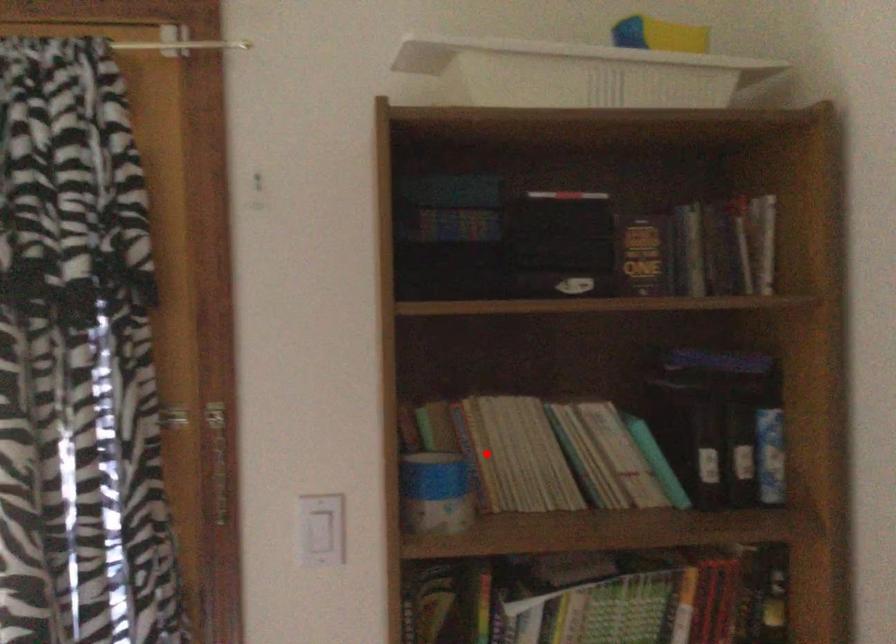
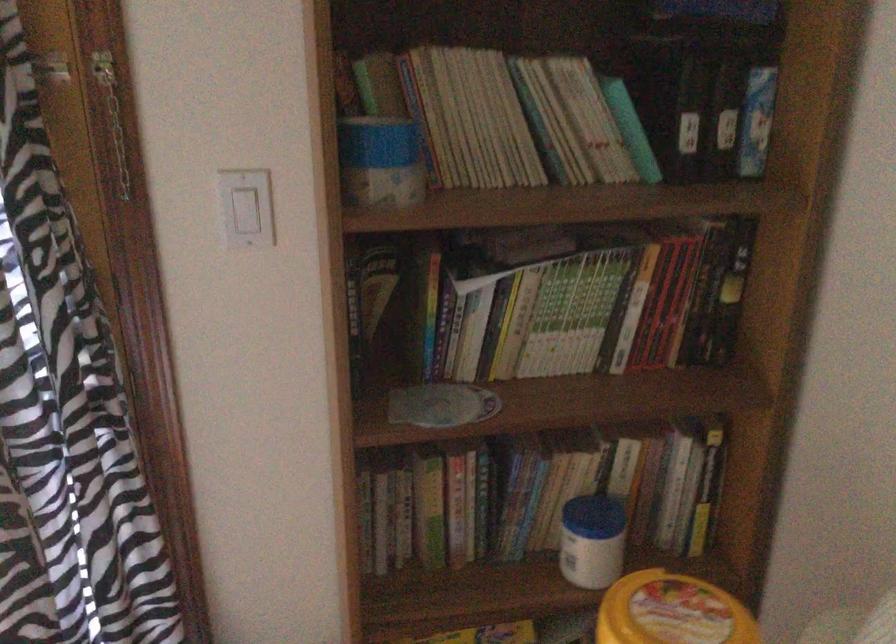
Find the pixel in the second image that matches the highlighted location in the first image.

(438, 117)